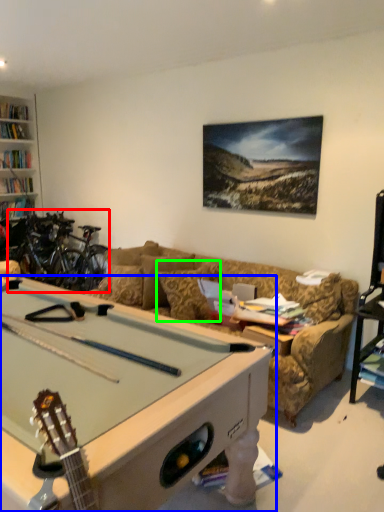
Question: Based on their relative distances, which object is farther from bicycle (highlighted by a red box)? Choose from billiard table (highlighted by a blue box) and pillow (highlighted by a green box).

Choices:
 (A) billiard table
 (B) pillow

Answer: (A)